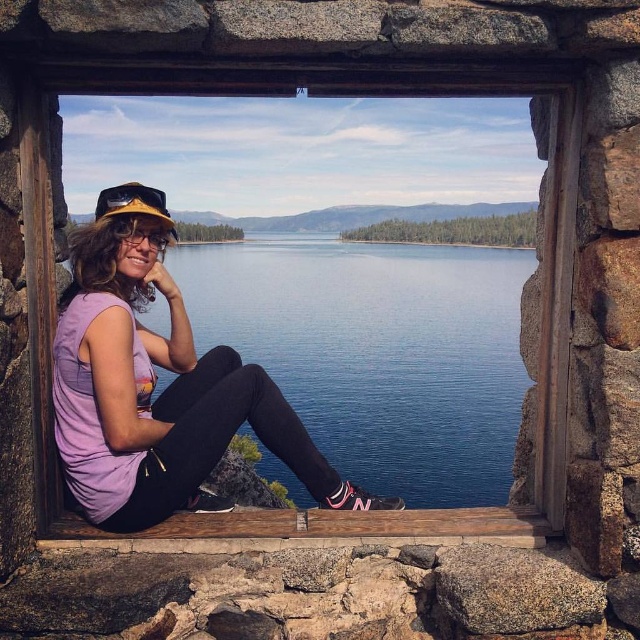
Based on the scene described, which object occupies a greater area within the frame between the blue water at center and the wooden at center?

The blue water at center is larger in size than the wooden at center, so it occupies a greater area within the frame.